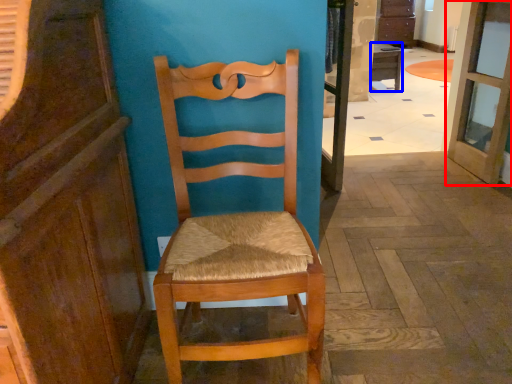
Question: Among these objects, which one is farthest to the camera, door (highlighted by a red box) or desk (highlighted by a blue box)?

Choices:
 (A) door
 (B) desk

Answer: (B)